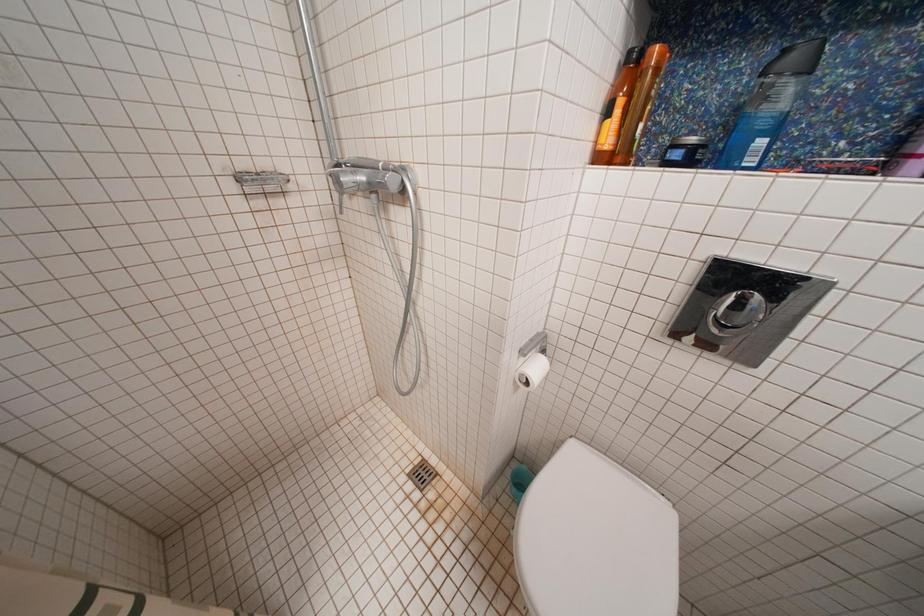
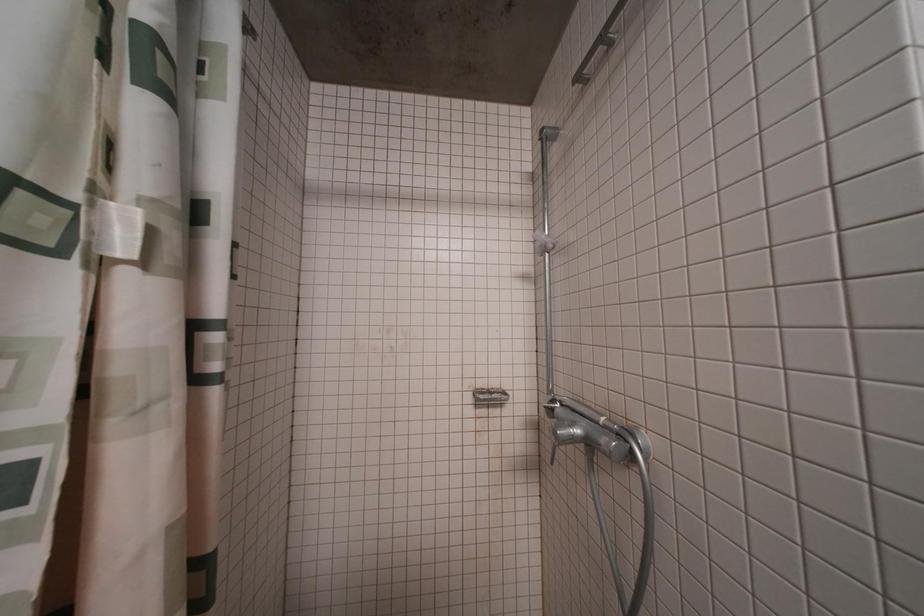
The first image is from the beginning of the video and the second image is from the end. How did the camera likely rotate when shooting the video?

The rotation direction of the camera is left-up.